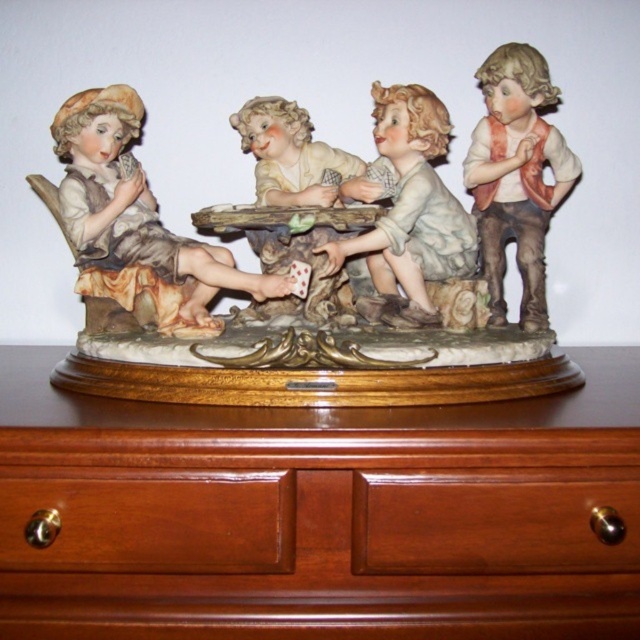
Is brown wood drawer at lower center taller than matte white porcelain boy at upper right?

In fact, brown wood drawer at lower center may be shorter than matte white porcelain boy at upper right.

Who is lower down, brown wood drawer at lower center or matte white porcelain boy at upper right?

brown wood drawer at lower center is below.

Find the location of a particular element. This screenshot has width=640, height=640. brown wood drawer at lower center is located at coordinates (493, 522).

Is point (397, 108) more distant than point (524, 273)?

No.

Is porcelain figurines at center closer to the viewer compared to matte white porcelain boy at upper right?

Yes, porcelain figurines at center is closer to the viewer.

Identify the location of porcelain figurines at center. This screenshot has width=640, height=640. (346, 289).

You are a GUI agent. You are given a task and a screenshot of the screen. Output one action in this format:
    pyautogui.click(x=<x>, y=<y>)
    Task: Click on the porcelain figurines at center
    Image resolution: width=640 pixels, height=640 pixels.
    Given the screenshot: What is the action you would take?
    pyautogui.click(x=346, y=289)

Which of these two, porcelain doll at left or porcelain doll at center, stands taller?

porcelain doll at left

Can you confirm if porcelain doll at left is positioned above porcelain doll at center?

No.

Does point (148, 264) lie behind point (349, 244)?

Yes, it is.

The width and height of the screenshot is (640, 640). In order to click on porcelain doll at left in this screenshot , I will do `click(134, 216)`.